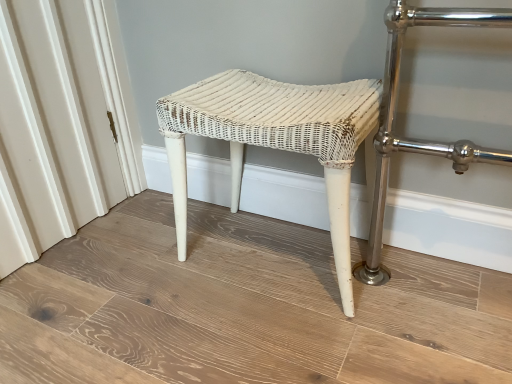
I want to click on blank space to the left of white wicker stool at center, so click(146, 268).